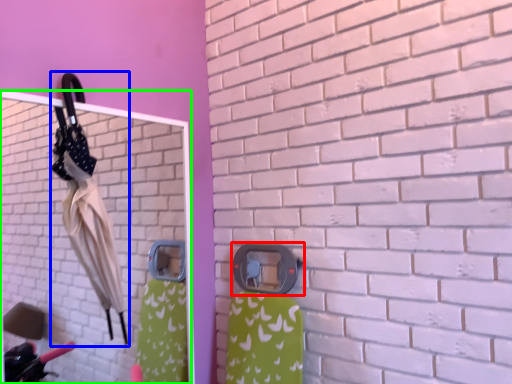
Question: Based on their relative distances, which object is farther from door handle (highlighted by a red box)? Choose from umbrella (highlighted by a blue box) and mirror (highlighted by a green box).

Choices:
 (A) umbrella
 (B) mirror

Answer: (B)